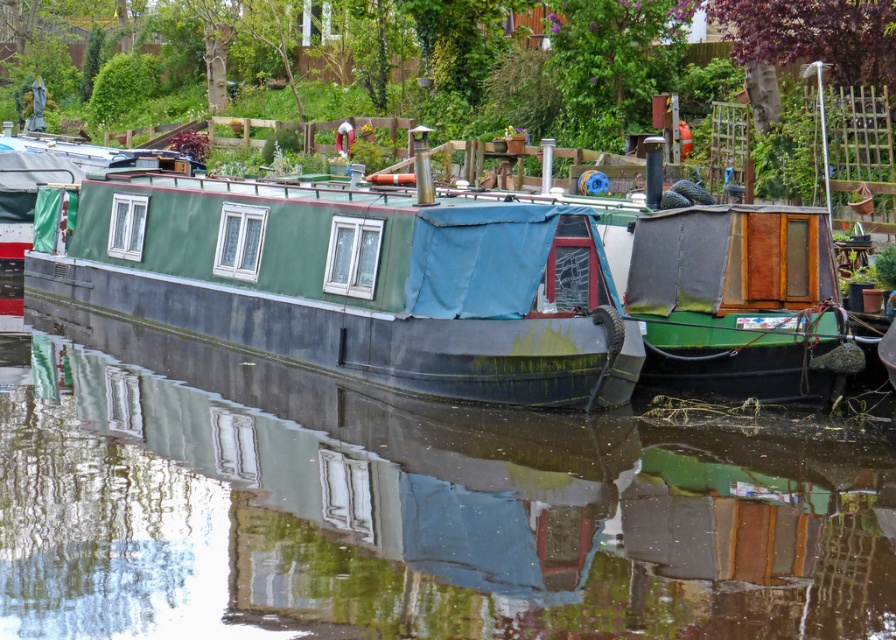
You are standing on the dock and see the green matte boat at center and the green matte houseboat at center. Which one is positioned lower in the scene?

The green matte boat at center is positioned lower than the green matte houseboat at center in the scene.